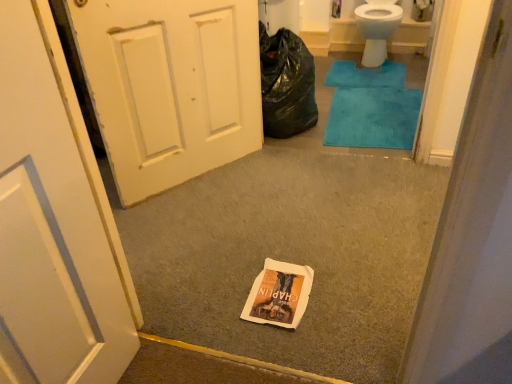
Question: Is white painted wood door at left not within white paper bag at center?

Choices:
 (A) no
 (B) yes

Answer: (B)

Question: Is the depth of white painted wood door at left greater than that of white paper bag at center?

Choices:
 (A) yes
 (B) no

Answer: (A)

Question: Is white painted wood door at left shorter than white paper bag at center?

Choices:
 (A) no
 (B) yes

Answer: (A)

Question: Is white painted wood door at left in front of white paper bag at center?

Choices:
 (A) no
 (B) yes

Answer: (A)

Question: Is white painted wood door at left far away from white paper bag at center?

Choices:
 (A) yes
 (B) no

Answer: (B)

Question: Considering the relative positions of white paper bag at center and blue plush bath mat at upper right, which is counted as the first bath mat, starting from the top, in the image provided, is white paper bag at center to the left or to the right of blue plush bath mat at upper right, which is counted as the first bath mat, starting from the top,?

Choices:
 (A) left
 (B) right

Answer: (A)

Question: From the image's perspective, is white paper bag at center positioned above or below blue plush bath mat at upper right, which is counted as the first bath mat, starting from the top?

Choices:
 (A) below
 (B) above

Answer: (A)

Question: Considering the positions of point click(x=305, y=273) and point click(x=374, y=71), is point click(x=305, y=273) closer or farther from the camera than point click(x=374, y=71)?

Choices:
 (A) farther
 (B) closer

Answer: (B)

Question: From a real-world perspective, is white paper bag at center above or below blue plush bath mat at upper right, positioned as the second bath mat in bottom-to-top order?

Choices:
 (A) below
 (B) above

Answer: (A)

Question: Looking at the image, does blue plush bath mat at upper right, which is counted as the first bath mat, starting from the top, seem bigger or smaller compared to teal plush bath mat at center, acting as the 2th bath mat starting from the back?

Choices:
 (A) small
 (B) big

Answer: (A)

Question: Does point (367, 79) appear closer or farther from the camera than point (343, 77)?

Choices:
 (A) farther
 (B) closer

Answer: (B)

Question: Relative to teal plush bath mat at center, the second bath mat viewed from the top, is blue plush bath mat at upper right, the first bath mat in the back-to-front sequence, in front or behind?

Choices:
 (A) front
 (B) behind

Answer: (B)

Question: Based on their positions, is blue plush bath mat at upper right, which is counted as the first bath mat, starting from the top, located to the left or right of teal plush bath mat at center, positioned as the first bath mat in front-to-back order?

Choices:
 (A) left
 (B) right

Answer: (B)

Question: From a real-world perspective, is blue plush bath mat at upper right, positioned as the second bath mat in bottom-to-top order, positioned above or below black plastic bag at upper right?

Choices:
 (A) above
 (B) below

Answer: (B)

Question: Would you say blue plush bath mat at upper right, the first bath mat in the back-to-front sequence, is inside or outside black plastic bag at upper right?

Choices:
 (A) inside
 (B) outside

Answer: (B)